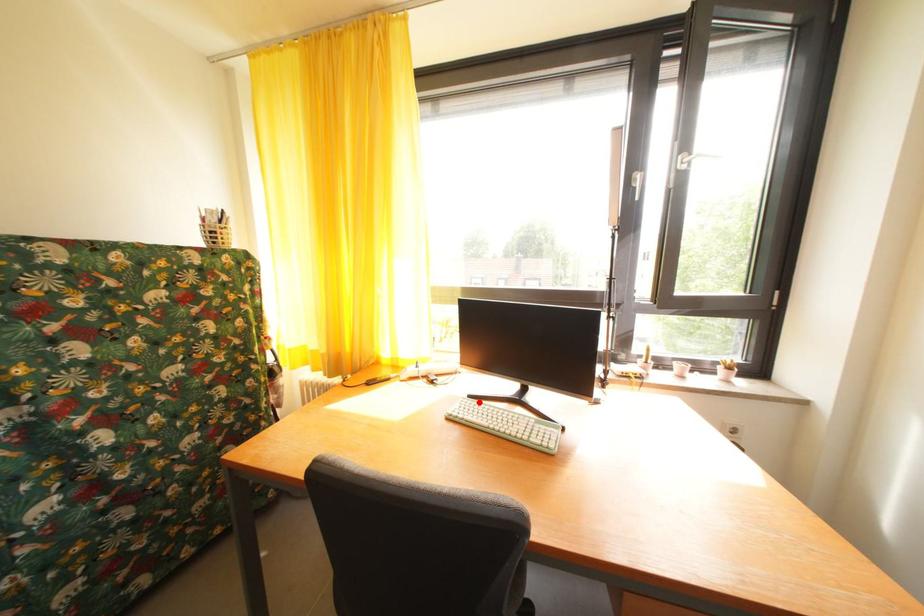
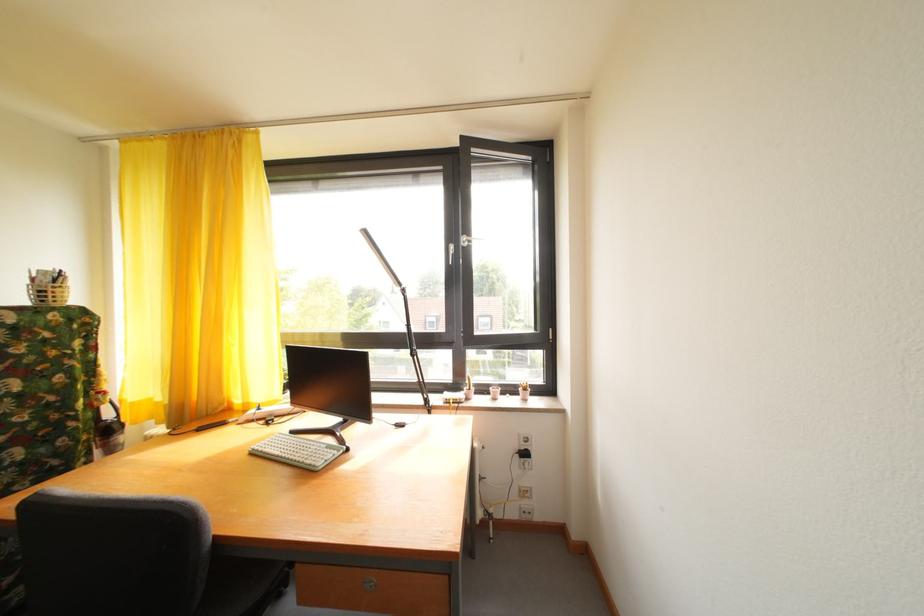
Locate, in the second image, the point that corresponds to the highlighted location in the first image.

(301, 438)